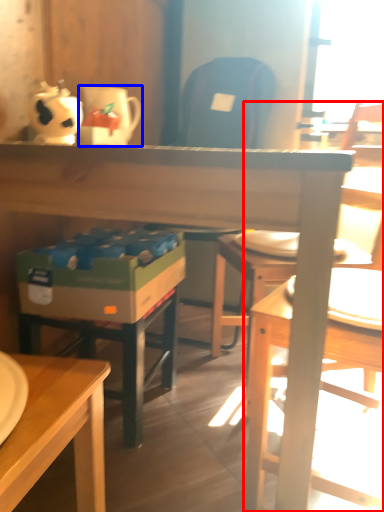
Question: Among these objects, which one is farthest to the camera, chair (highlighted by a red box) or coffee cup (highlighted by a blue box)?

Choices:
 (A) chair
 (B) coffee cup

Answer: (B)